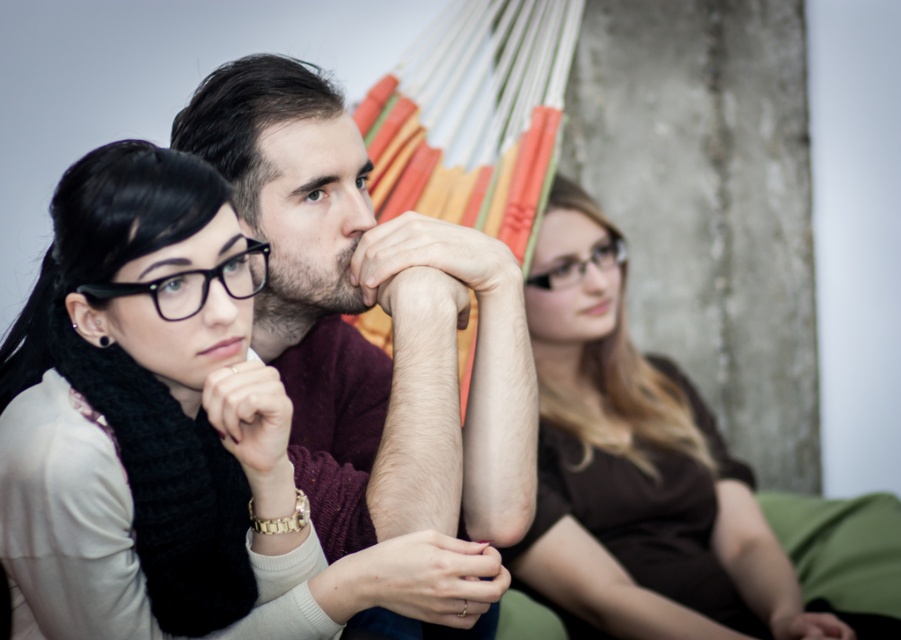
Looking at this image, you are taking a photo of the three people in the scene. To ensure the black matte glasses at center are in focus, where should you aim your camera?

The black matte glasses at center are located at point (193, 284), so you should aim your camera at that coordinate to ensure they are in focus.

You are standing in the scene and want to place a small decorative item between the two points, point (253, 252) and point (605, 257). Which point should the item be closer to in order to be placed in front of both points?

The item should be placed closer to point (253, 252) because it is in front of point (605, 257).